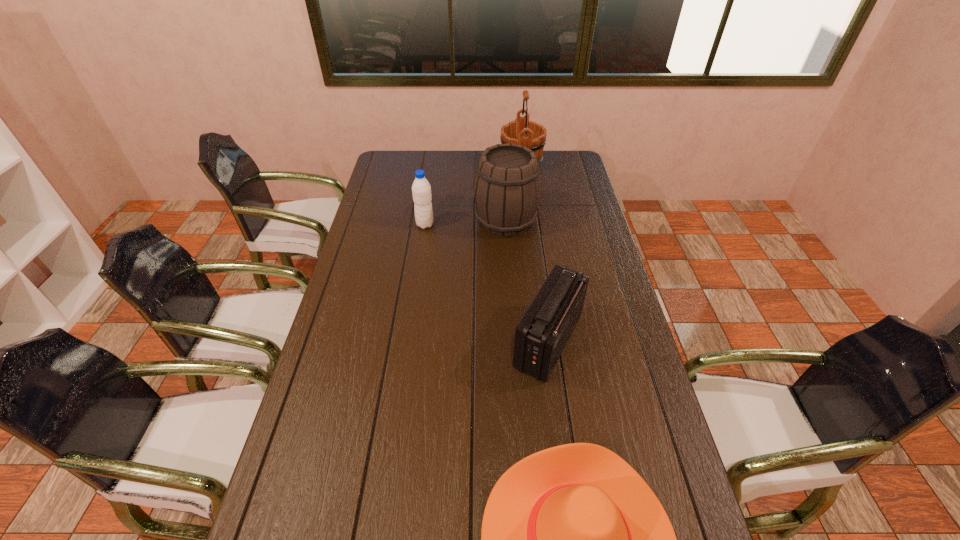
Find the location of `unoccupied position between the water bottle and the farthest object`. unoccupied position between the water bottle and the farthest object is located at coordinates click(x=473, y=194).

The height and width of the screenshot is (540, 960). Find the location of `vacant area between the water bottle and the taller wine bucket`. vacant area between the water bottle and the taller wine bucket is located at coordinates (473, 194).

The width and height of the screenshot is (960, 540). Identify the location of vacant space that's between the leftmost object and the second nearest object. (487, 283).

Select which object is the fourth closest to the taller wine bucket. Please provide its 2D coordinates. Your answer should be formatted as a tuple, i.e. [(x, y)], where the tuple contains the x and y coordinates of a point satisfying the conditions above.

[(573, 539)]

Identify which object is the fourth nearest to the nearest object. Please provide its 2D coordinates. Your answer should be formatted as a tuple, i.e. [(x, y)], where the tuple contains the x and y coordinates of a point satisfying the conditions above.

[(530, 134)]